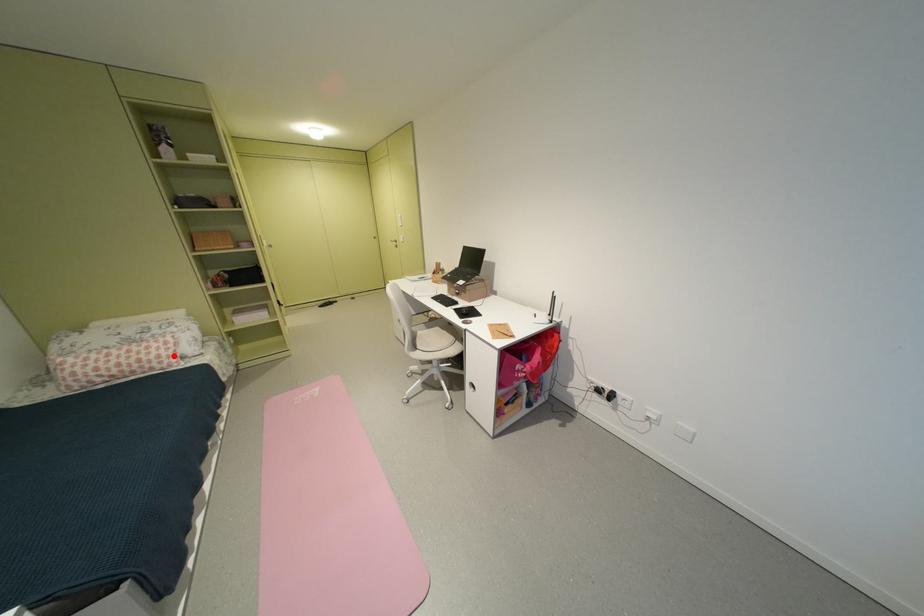
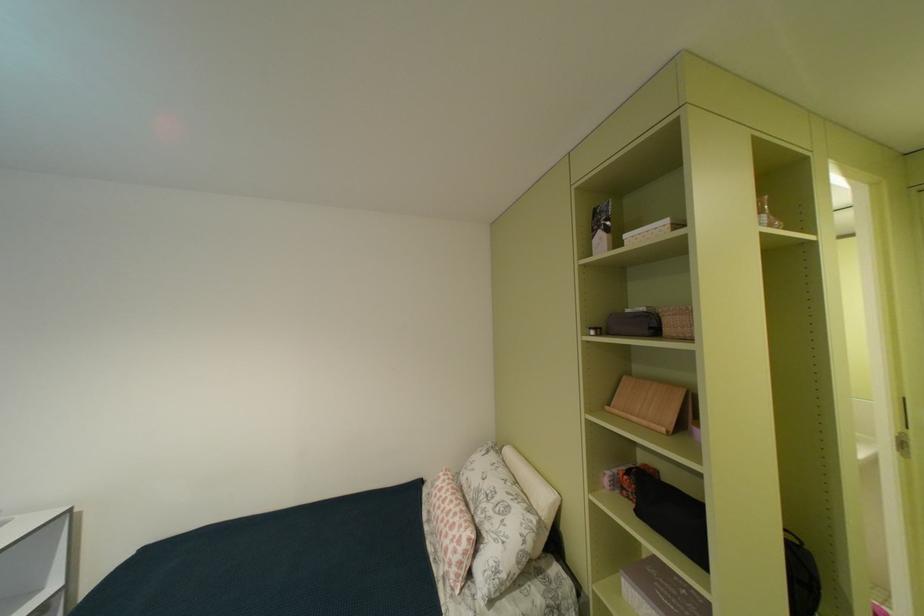
Question: I am providing you with two images of the same scene from different viewpoints. Given a red point in image1, look at the same physical point in image2. Is it:

Choices:
 (A) Closer to the viewpoint
 (B) Farther from the viewpoint

Answer: (B)